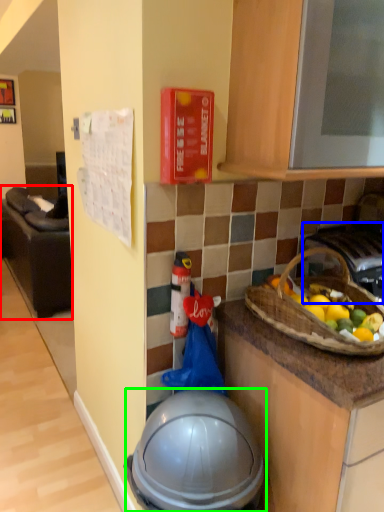
Question: Which is farther away from furniture (highlighted by a red box)? gas stove (highlighted by a blue box) or helmet (highlighted by a green box)?

Choices:
 (A) gas stove
 (B) helmet

Answer: (A)